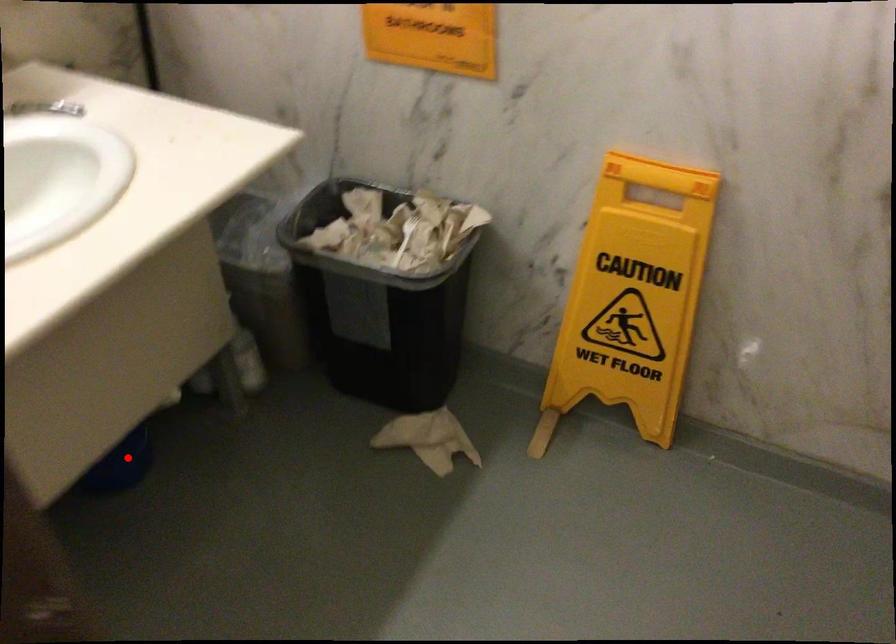
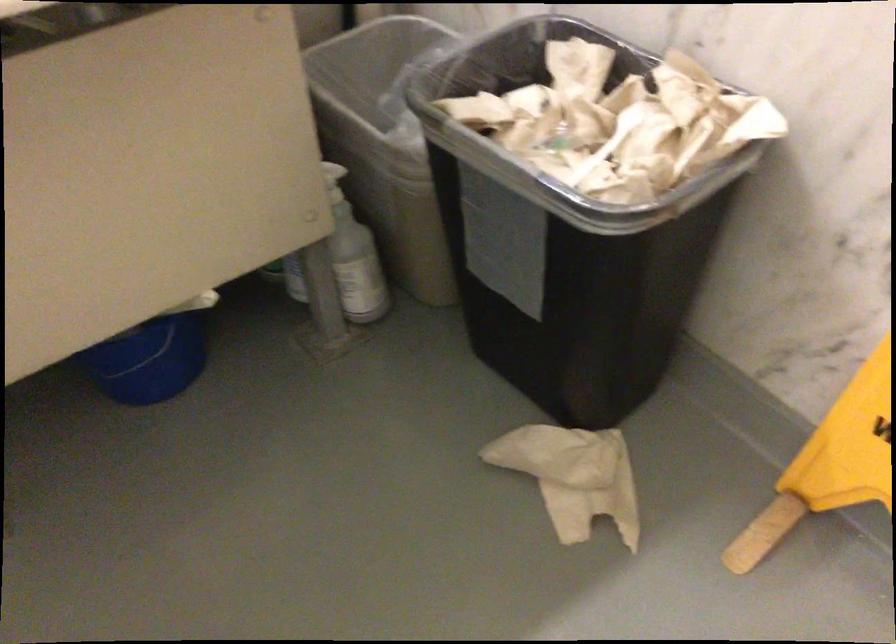
Question: I am providing you with two images of the same scene from different viewpoints. A red point is shown in image1. For the corresponding object point in image2, is it positioned nearer or farther from the camera?

Choices:
 (A) Nearer
 (B) Farther

Answer: (A)